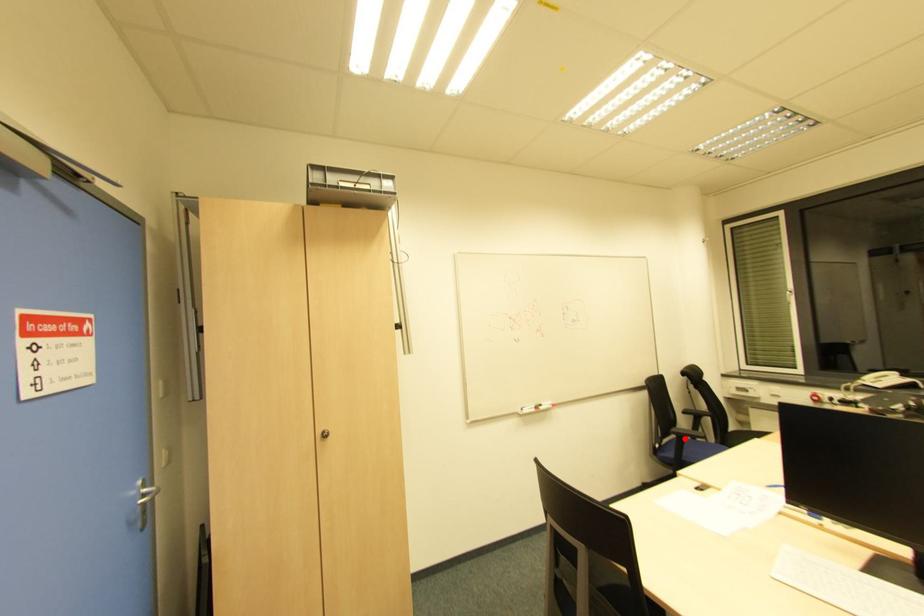
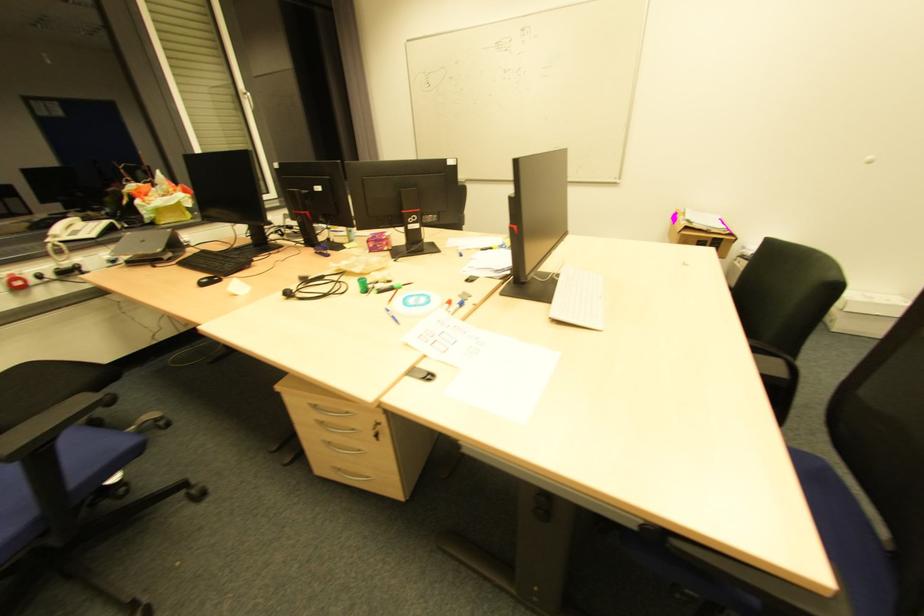
Where in the second image is the point corresponding to the highlighted location from the first image?

(51, 440)